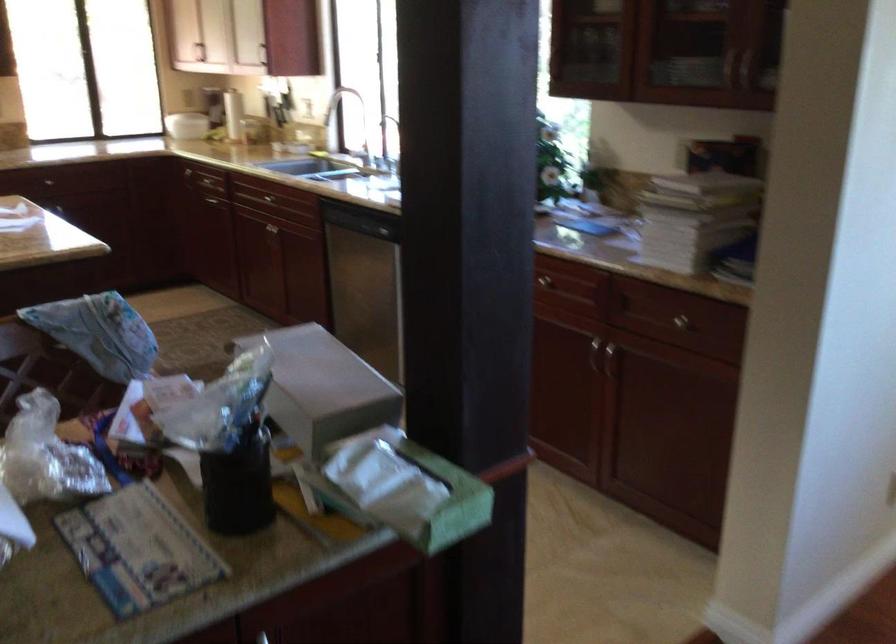
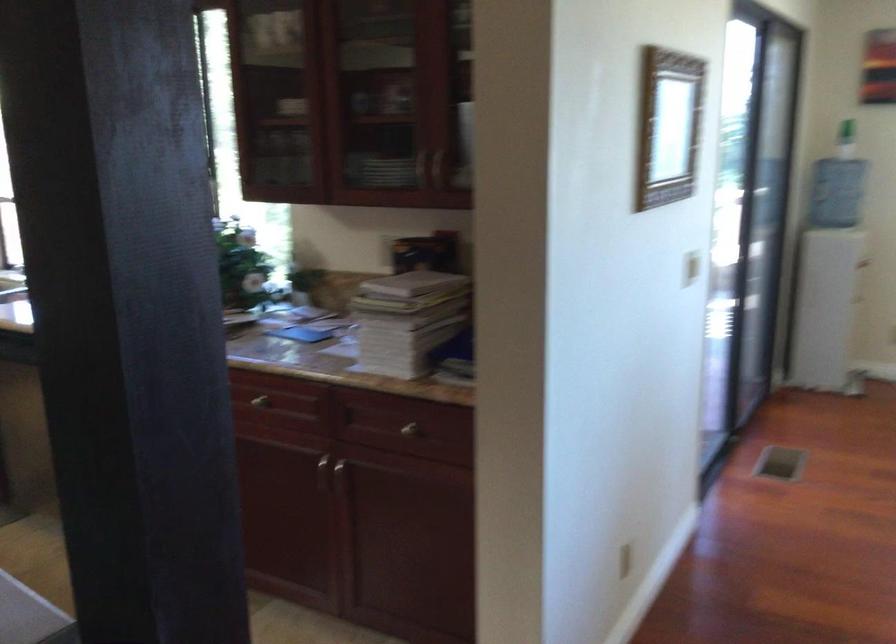
Question: The first image is from the beginning of the video and the second image is from the end. How did the camera likely rotate when shooting the video?

Choices:
 (A) Left
 (B) Right
 (C) Up
 (D) Down

Answer: (B)